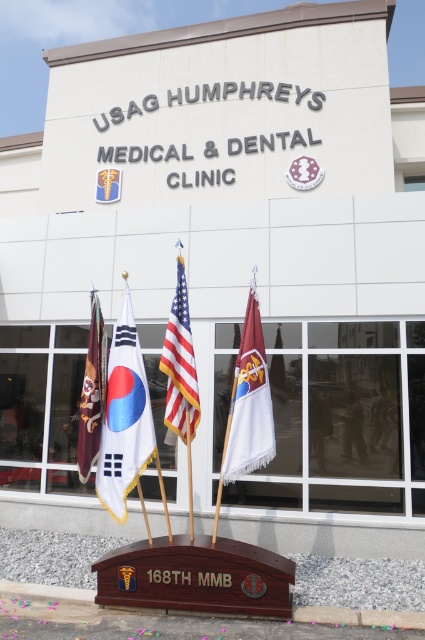
Does white fabric flag at center come in front of polished wood flag at center?

Yes, it is.

Can you confirm if white fabric flag at center is bigger than polished wood flag at center?

Indeed, white fabric flag at center has a larger size compared to polished wood flag at center.

You are a GUI agent. You are given a task and a screenshot of the screen. Output one action in this format:
    pyautogui.click(x=<x>, y=<y>)
    Task: Click on the white fabric flag at center
    The image size is (425, 640).
    Given the screenshot: What is the action you would take?
    pyautogui.click(x=124, y=419)

Who is higher up, white fabric flag at center or brown leather flag at left?

brown leather flag at left is higher up.

Is white fabric flag at center bigger than brown leather flag at left?

Yes.

At what (x,y) coordinates should I click in order to perform the action: click on white fabric flag at center. Please return your answer as a coordinate pair (x, y). The image size is (425, 640). Looking at the image, I should click on (124, 419).

Between point (249, 458) and point (90, 464), which one is positioned in front?

Point (249, 458)

Who is more distant from viewer, (269, 416) or (91, 368)?

Positioned behind is point (91, 368).

What are the coordinates of `maroon fabric flag at center` in the screenshot? It's located at (249, 401).